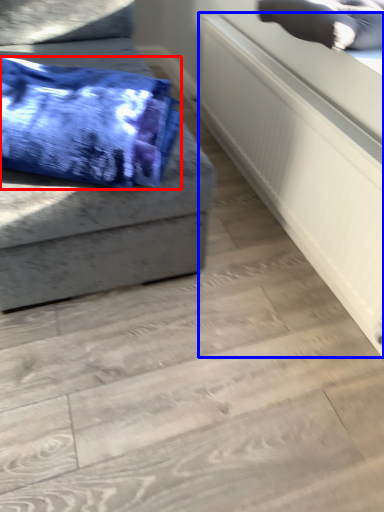
Question: Among these objects, which one is farthest to the camera, blanket (highlighted by a red box) or radiator (highlighted by a blue box)?

Choices:
 (A) blanket
 (B) radiator

Answer: (B)